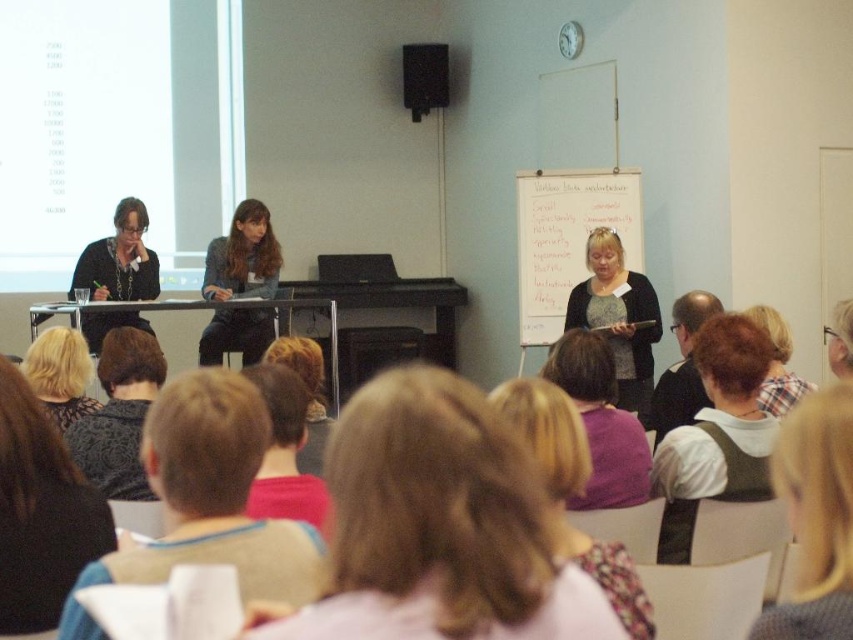
Question: Which point is farther to the camera?

Choices:
 (A) blonde hair at lower left
 (B) plaid shirt at lower right
 (C) blonde hair at lower right
 (D) matte black pants at center

Answer: (D)

Question: Can you confirm if blonde hair at lower right is bigger than light brown hair at lower right?

Choices:
 (A) no
 (B) yes

Answer: (A)

Question: Can you confirm if blonde hair at lower left is wider than light brown hair at lower right?

Choices:
 (A) no
 (B) yes

Answer: (B)

Question: Which object is closer to the camera taking this photo?

Choices:
 (A) knitted sweater at center
 (B) floral-patterned blouse at center
 (C) matte black pants at center

Answer: (B)

Question: Which of the following is the closest to the observer?

Choices:
 (A) matte black pants at center
 (B) glossy plastic glasses at upper right
 (C) pink fabric at center
 (D) knitted sweater at center

Answer: (C)

Question: Can you confirm if matte black pants at center is bigger than matte black jacket at left?

Choices:
 (A) no
 (B) yes

Answer: (A)